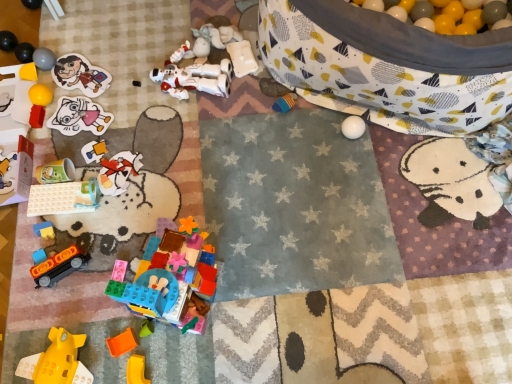
Question: Is matte plastic cup at upper left, positioned as the 1th toy in top-to-bottom order, not within yellow matte plastic block at lower left, the 17th toy positioned from the top?

Choices:
 (A) yes
 (B) no

Answer: (A)

Question: Does matte plastic cup at upper left, which appears as the 17th toy when ordered from the bottom, appear on the right side of yellow matte plastic block at lower left, the first toy positioned from the bottom?

Choices:
 (A) no
 (B) yes

Answer: (A)

Question: Can you confirm if matte plastic cup at upper left, positioned as the 1th toy in top-to-bottom order, is wider than yellow matte plastic block at lower left, the first toy positioned from the bottom?

Choices:
 (A) yes
 (B) no

Answer: (A)

Question: Considering the relative positions of matte plastic cup at upper left, positioned as the 1th toy in top-to-bottom order, and yellow matte plastic block at lower left, the first toy positioned from the bottom, in the image provided, is matte plastic cup at upper left, positioned as the 1th toy in top-to-bottom order, behind yellow matte plastic block at lower left, the first toy positioned from the bottom,?

Choices:
 (A) no
 (B) yes

Answer: (B)

Question: Is matte plastic cup at upper left, positioned as the 1th toy in top-to-bottom order, facing away from yellow matte plastic block at lower left, the first toy positioned from the bottom?

Choices:
 (A) no
 (B) yes

Answer: (A)

Question: Considering the relative sizes of matte plastic cup at upper left, positioned as the 1th toy in top-to-bottom order, and yellow matte plastic block at lower left, the 17th toy positioned from the top, in the image provided, is matte plastic cup at upper left, positioned as the 1th toy in top-to-bottom order, taller than yellow matte plastic block at lower left, the 17th toy positioned from the top,?

Choices:
 (A) no
 (B) yes

Answer: (B)

Question: From a real-world perspective, is matte gray ball at upper left, marked as the 3th toy in a top-to-bottom arrangement, physically above matte paper sticker at upper left, which is counted as the 13th toy, starting from the bottom?

Choices:
 (A) no
 (B) yes

Answer: (B)

Question: From a real-world perspective, does matte gray ball at upper left, marked as the fifteenth toy in a bottom-to-top arrangement, sit lower than matte paper sticker at upper left, which ranks as the fifth toy in top-to-bottom order?

Choices:
 (A) no
 (B) yes

Answer: (A)

Question: Is matte gray ball at upper left, marked as the fifteenth toy in a bottom-to-top arrangement, at the left side of matte paper sticker at upper left, which ranks as the fifth toy in top-to-bottom order?

Choices:
 (A) no
 (B) yes

Answer: (B)

Question: Is matte gray ball at upper left, marked as the 3th toy in a top-to-bottom arrangement, not close to matte paper sticker at upper left, which is counted as the 13th toy, starting from the bottom?

Choices:
 (A) yes
 (B) no

Answer: (B)

Question: From the image's perspective, would you say matte gray ball at upper left, marked as the 3th toy in a top-to-bottom arrangement, is shown under matte paper sticker at upper left, which is counted as the 13th toy, starting from the bottom?

Choices:
 (A) no
 (B) yes

Answer: (A)

Question: Can you confirm if matte gray ball at upper left, marked as the fifteenth toy in a bottom-to-top arrangement, is taller than matte paper sticker at upper left, which is counted as the 13th toy, starting from the bottom?

Choices:
 (A) no
 (B) yes

Answer: (B)

Question: From a real-world perspective, is translucent plastic building blocks at lower center, placed as the 12th toy when sorted from top to bottom, beneath matte plastic cup at upper left, which appears as the 17th toy when ordered from the bottom?

Choices:
 (A) yes
 (B) no

Answer: (B)